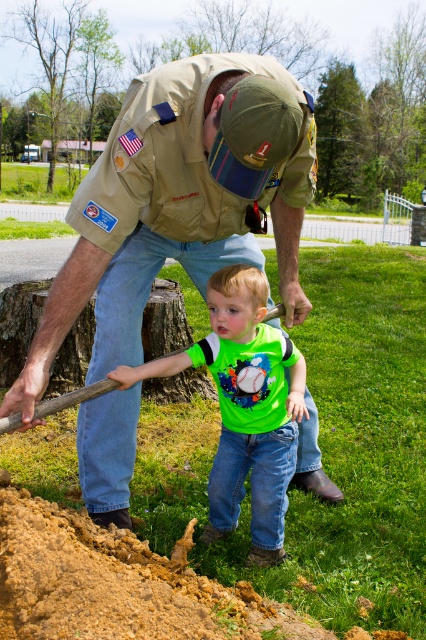
Question: Is khaki uniform at center bigger than green matte shirt at center?

Choices:
 (A) no
 (B) yes

Answer: (B)

Question: Which point is farther from the camera taking this photo?

Choices:
 (A) (189, 68)
 (B) (261, 417)
 (C) (43, 637)

Answer: (B)

Question: Is khaki uniform at center above green matte shirt at center?

Choices:
 (A) no
 (B) yes

Answer: (B)

Question: Which of these objects is positioned farthest from the khaki uniform at center?

Choices:
 (A) green matte shirt at center
 (B) brown sandy soil at lower left

Answer: (B)

Question: Among these objects, which one is nearest to the camera?

Choices:
 (A) brown sandy soil at lower left
 (B) green matte shirt at center

Answer: (A)

Question: Can you confirm if khaki uniform at center is wider than brown sandy soil at lower left?

Choices:
 (A) no
 (B) yes

Answer: (A)